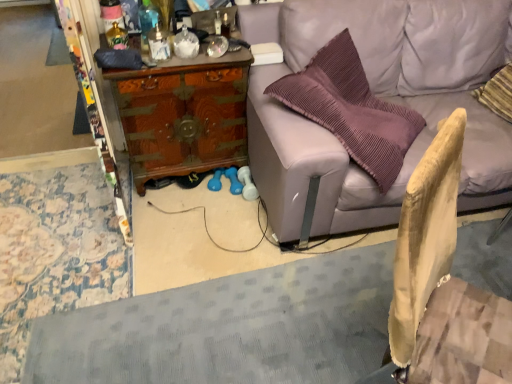
Question: Could you tell me if light purple leather couch at upper right is facing translucent glass bottle at upper left, which appears as the 2th bottle when viewed from the right?

Choices:
 (A) no
 (B) yes

Answer: (A)

Question: Does light purple leather couch at upper right have a lesser width compared to translucent glass bottle at upper left, which appears as the 2th bottle when viewed from the right?

Choices:
 (A) no
 (B) yes

Answer: (A)

Question: Considering the relative sizes of light purple leather couch at upper right and translucent glass bottle at upper left, which appears as the 2th bottle when viewed from the right, in the image provided, is light purple leather couch at upper right wider than translucent glass bottle at upper left, which appears as the 2th bottle when viewed from the right,?

Choices:
 (A) yes
 (B) no

Answer: (A)

Question: Is light purple leather couch at upper right directly adjacent to translucent glass bottle at upper left, which appears as the 2th bottle when viewed from the right?

Choices:
 (A) no
 (B) yes

Answer: (A)

Question: Considering the relative sizes of light purple leather couch at upper right and translucent glass bottle at upper left, which appears as the 2th bottle when viewed from the right, in the image provided, is light purple leather couch at upper right bigger than translucent glass bottle at upper left, which appears as the 2th bottle when viewed from the right,?

Choices:
 (A) yes
 (B) no

Answer: (A)

Question: In the image, is light purple leather couch at upper right positioned in front of or behind light brown wood swivel chair at lower right?

Choices:
 (A) behind
 (B) front

Answer: (A)

Question: From a real-world perspective, relative to light brown wood swivel chair at lower right, is light purple leather couch at upper right vertically above or below?

Choices:
 (A) below
 (B) above

Answer: (A)

Question: Considering the positions of point (290, 33) and point (458, 294), is point (290, 33) closer or farther from the camera than point (458, 294)?

Choices:
 (A) farther
 (B) closer

Answer: (A)

Question: Choose the correct answer: Is light purple leather couch at upper right inside light brown wood swivel chair at lower right or outside it?

Choices:
 (A) inside
 (B) outside

Answer: (B)

Question: In the image, is light brown wood swivel chair at lower right on the left side or the right side of translucent glass bottle at upper center, the second bottle positioned from the left?

Choices:
 (A) right
 (B) left

Answer: (A)

Question: Is light brown wood swivel chair at lower right situated inside translucent glass bottle at upper center, the second bottle positioned from the left, or outside?

Choices:
 (A) inside
 (B) outside

Answer: (B)

Question: Is point (465, 302) closer or farther from the camera than point (158, 36)?

Choices:
 (A) closer
 (B) farther

Answer: (A)

Question: Is light brown wood swivel chair at lower right taller or shorter than translucent glass bottle at upper center, the first bottle in the right-to-left sequence?

Choices:
 (A) short
 (B) tall

Answer: (B)

Question: Would you say translucent glass bottle at upper center, the first bottle in the right-to-left sequence, is inside or outside wooden chest at center?

Choices:
 (A) inside
 (B) outside

Answer: (B)

Question: From a real-world perspective, is translucent glass bottle at upper center, the second bottle positioned from the left, positioned above or below wooden chest at center?

Choices:
 (A) below
 (B) above

Answer: (B)